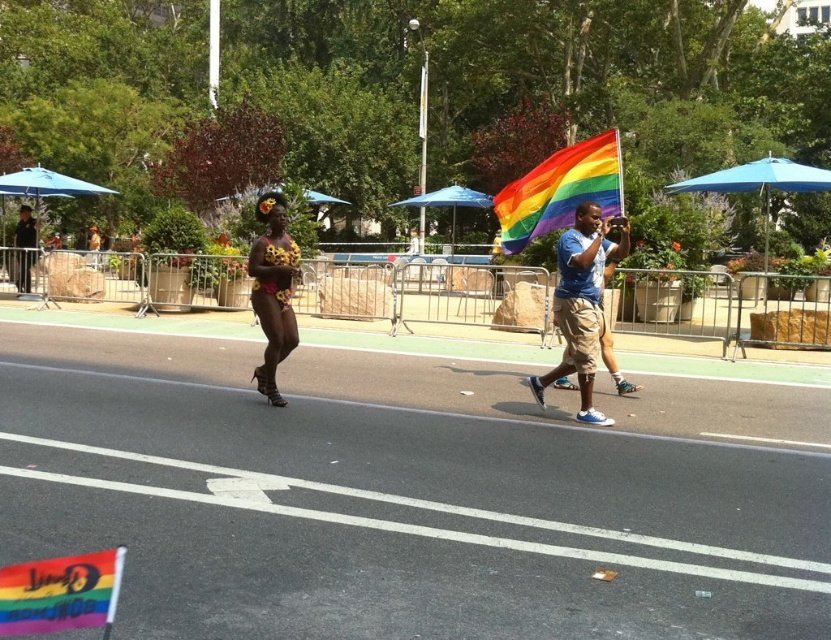
Does blue cotton shirt at center appear on the right side of floral-patterned fabric at center?

Indeed, blue cotton shirt at center is positioned on the right side of floral-patterned fabric at center.

This screenshot has width=831, height=640. What are the coordinates of `blue cotton shirt at center` in the screenshot? It's located at (581, 304).

Does point (581, 332) lie behind point (279, 289)?

No, it is not.

This screenshot has width=831, height=640. Identify the location of blue cotton shirt at center. (581, 304).

Who is positioned more to the right, blue fabric umbrella at center or rainbow fabric umbrella at upper center?

blue fabric umbrella at center

Which is below, blue fabric umbrella at center or rainbow fabric umbrella at upper center?

blue fabric umbrella at center is below.

Between point (450, 205) and point (315, 196), which one is positioned behind?

The point (450, 205) is behind.

Locate an element on the screen. The width and height of the screenshot is (831, 640). blue fabric umbrella at center is located at coordinates (450, 202).

Is floral-patterned fabric at center to the right of blue fabric umbrella at upper right from the viewer's perspective?

Incorrect, floral-patterned fabric at center is not on the right side of blue fabric umbrella at upper right.

Is floral-patterned fabric at center wider than blue fabric umbrella at upper right?

No.

Is point (259, 374) positioned in front of point (829, 182)?

Yes, point (259, 374) is in front of point (829, 182).

Locate an element on the screen. floral-patterned fabric at center is located at coordinates (273, 289).